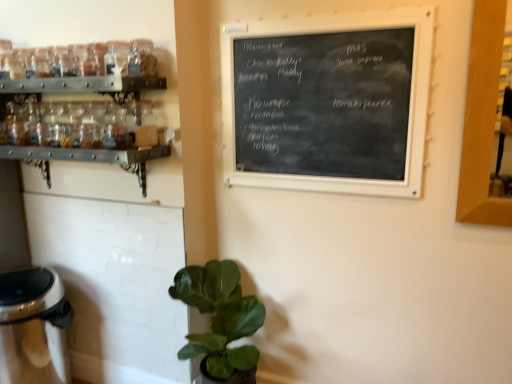
Measure the distance between point (369,60) and camera.

The depth of point (369,60) is 5.32 feet.

Image resolution: width=512 pixels, height=384 pixels. Find the location of `green matte plant at lower center`. green matte plant at lower center is located at coordinates (219, 317).

Can you confirm if green matte plant at lower center is thinner than satin silver trash can at lower left?

Correct, the width of green matte plant at lower center is less than that of satin silver trash can at lower left.

Between green matte plant at lower center and satin silver trash can at lower left, which one appears on the left side from the viewer's perspective?

Positioned to the left is satin silver trash can at lower left.

Can you confirm if green matte plant at lower center is taller than satin silver trash can at lower left?

Yes, green matte plant at lower center is taller than satin silver trash can at lower left.

Is black chalkboard at upper center at the back of satin silver trash can at lower left?

satin silver trash can at lower left is not turned away from black chalkboard at upper center.

Is satin silver trash can at lower left shorter than black chalkboard at upper center?

Indeed, satin silver trash can at lower left has a lesser height compared to black chalkboard at upper center.

Considering the positions of objects satin silver trash can at lower left and black chalkboard at upper center in the image provided, who is more to the right, satin silver trash can at lower left or black chalkboard at upper center?

Positioned to the right is black chalkboard at upper center.

Who is smaller, satin silver trash can at lower left or black chalkboard at upper center?

Smaller between the two is black chalkboard at upper center.

Are green matte plant at lower center and black chalkboard at upper center making contact?

No, green matte plant at lower center is not with black chalkboard at upper center.

Is point (174, 283) farther from camera compared to point (389, 59)?

Yes, point (174, 283) is farther from viewer.

Is green matte plant at lower center positioned with its back to black chalkboard at upper center?

green matte plant at lower center is not turned away from black chalkboard at upper center.

Is green matte plant at lower center further to camera compared to black chalkboard at upper center?

That is True.

The width and height of the screenshot is (512, 384). I want to click on houseplant above the satin silver trash can at lower left (from a real-world perspective), so click(x=219, y=317).

From a real-world perspective, does satin silver trash can at lower left sit lower than green matte plant at lower center?

Indeed, from a real-world perspective, satin silver trash can at lower left is positioned beneath green matte plant at lower center.

Is the depth of satin silver trash can at lower left less than that of green matte plant at lower center?

No.

Which is in front, point (8, 309) or point (232, 329)?

The point (8, 309) is closer to the camera.

Is black chalkboard at upper center oriented away from satin silver trash can at lower left?

That's not correct — black chalkboard at upper center is not looking away from satin silver trash can at lower left.

Which object is wider, black chalkboard at upper center or satin silver trash can at lower left?

satin silver trash can at lower left.

From the image's perspective, between black chalkboard at upper center and satin silver trash can at lower left, who is located below?

satin silver trash can at lower left is shown below in the image.

Considering the sizes of clear glass jars at upper left and black chalkboard at upper center in the image, is clear glass jars at upper left taller or shorter than black chalkboard at upper center?

In the image, clear glass jars at upper left appears to be shorter than black chalkboard at upper center.

Based on their sizes in the image, would you say clear glass jars at upper left is bigger or smaller than black chalkboard at upper center?

Clearly, clear glass jars at upper left is larger in size than black chalkboard at upper center.

Is clear glass jars at upper left located outside black chalkboard at upper center?

That's correct, clear glass jars at upper left is outside of black chalkboard at upper center.

Considering the sizes of objects clear glass jars at upper left and black chalkboard at upper center in the image provided, who is wider, clear glass jars at upper left or black chalkboard at upper center?

clear glass jars at upper left is wider.

Can you tell me how much clear glass jars at upper left and satin silver trash can at lower left differ in facing direction?

The angle between the facing direction of clear glass jars at upper left and the facing direction of satin silver trash can at lower left is 1.02 degrees.

From a real-world perspective, which object stands above the other?

clear glass jars at upper left, from a real-world perspective.

From the picture: Which object is positioned more to the right, clear glass jars at upper left or satin silver trash can at lower left?

Positioned to the right is clear glass jars at upper left.

Identify the location of appliance below the green matte plant at lower center (from the image's perspective). (33, 327).

The image size is (512, 384). Find the location of `appliance that appears below the black chalkboard at upper center (from a real-world perspective)`. appliance that appears below the black chalkboard at upper center (from a real-world perspective) is located at coordinates (33, 327).

Considering their positions, is green matte plant at lower center positioned further to black chalkboard at upper center than satin silver trash can at lower left?

Based on the image, satin silver trash can at lower left appears to be further to black chalkboard at upper center.

Considering their positions, is satin silver trash can at lower left positioned further to clear glass jars at upper left than black chalkboard at upper center?

Among the two, satin silver trash can at lower left is located further to clear glass jars at upper left.

When comparing their distances from green matte plant at lower center, does black chalkboard at upper center or satin silver trash can at lower left seem further?

black chalkboard at upper center lies further to green matte plant at lower center than the other object.

Based on their spatial positions, is black chalkboard at upper center or clear glass jars at upper left closer to green matte plant at lower center?

black chalkboard at upper center.

Based on the photo, which object lies nearer to the anchor point clear glass jars at upper left, green matte plant at lower center or satin silver trash can at lower left?

The object closer to clear glass jars at upper left is green matte plant at lower center.

Estimate the real-world distances between objects in this image. Which object is further from clear glass jars at upper left, black chalkboard at upper center or satin silver trash can at lower left?

Among the two, satin silver trash can at lower left is located further to clear glass jars at upper left.

Looking at the image, which one is located further to clear glass jars at upper left, green matte plant at lower center or black chalkboard at upper center?

Based on the image, green matte plant at lower center appears to be further to clear glass jars at upper left.

Based on their spatial positions, is green matte plant at lower center or black chalkboard at upper center closer to satin silver trash can at lower left?

Among the two, green matte plant at lower center is located nearer to satin silver trash can at lower left.

Identify the location of shelf that lies between black chalkboard at upper center and green matte plant at lower center from top to bottom. The height and width of the screenshot is (384, 512). (83, 86).

The image size is (512, 384). I want to click on houseplant between satin silver trash can at lower left and black chalkboard at upper center in the horizontal direction, so click(219, 317).

Locate an element on the screen. Image resolution: width=512 pixels, height=384 pixels. shelf between satin silver trash can at lower left and black chalkboard at upper center is located at coordinates (83, 86).

Find the location of a particular element. The width and height of the screenshot is (512, 384). houseplant between clear glass jars at upper left and satin silver trash can at lower left in the up-down direction is located at coordinates (219, 317).